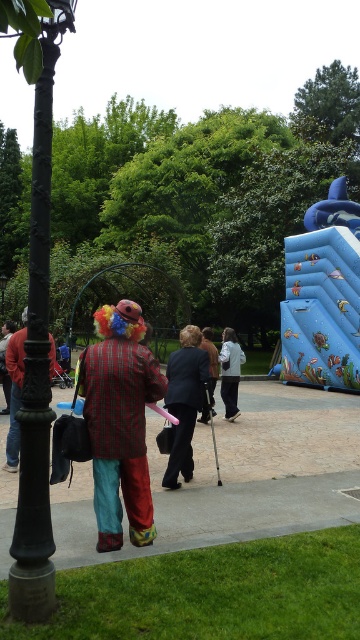
You are organizing a charity event and need to arrange two suits in a display case. The display case has limited space. Which suit, the dark blue suit at center or the dark gray suit at center, would you choose to fit better in the display case?

The dark blue suit at center occupies less space than the dark gray suit at center, so it would fit better in the display case with limited space.